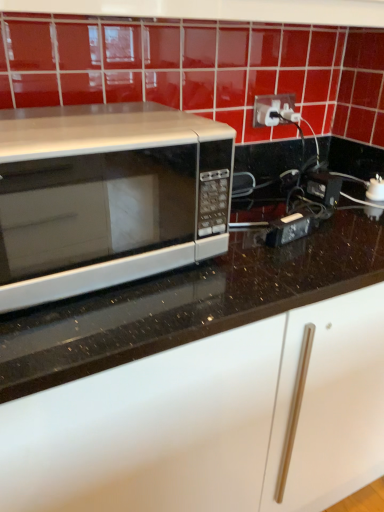
Where is `empty space that is ontop of satin silver microwave at left (from a real-world perspective)`? This screenshot has height=512, width=384. empty space that is ontop of satin silver microwave at left (from a real-world perspective) is located at coordinates (99, 114).